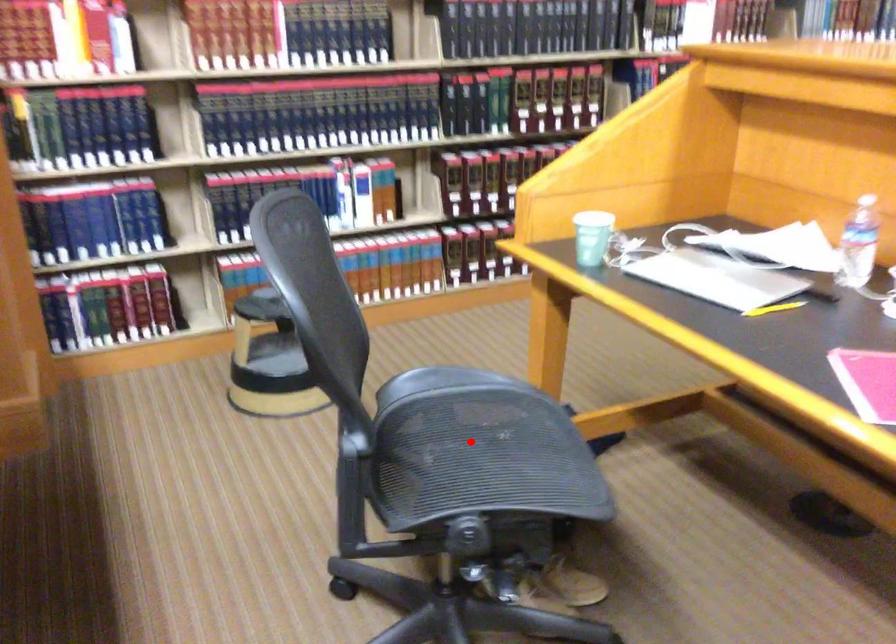
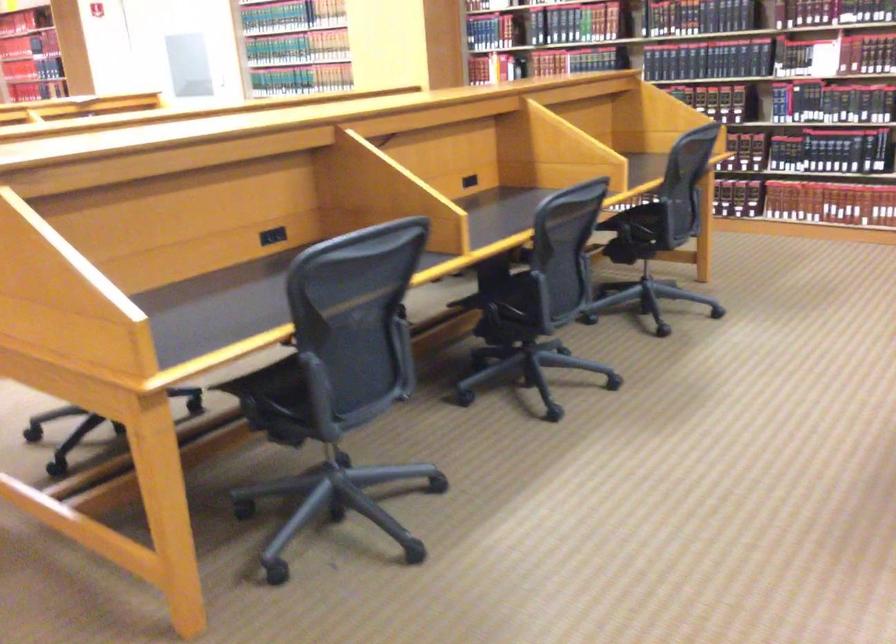
Question: I am providing you with two images of the same scene from different viewpoints. A red point is marked on the first image. Is the red point's position out of view in image 2?

Choices:
 (A) Yes
 (B) No

Answer: (A)